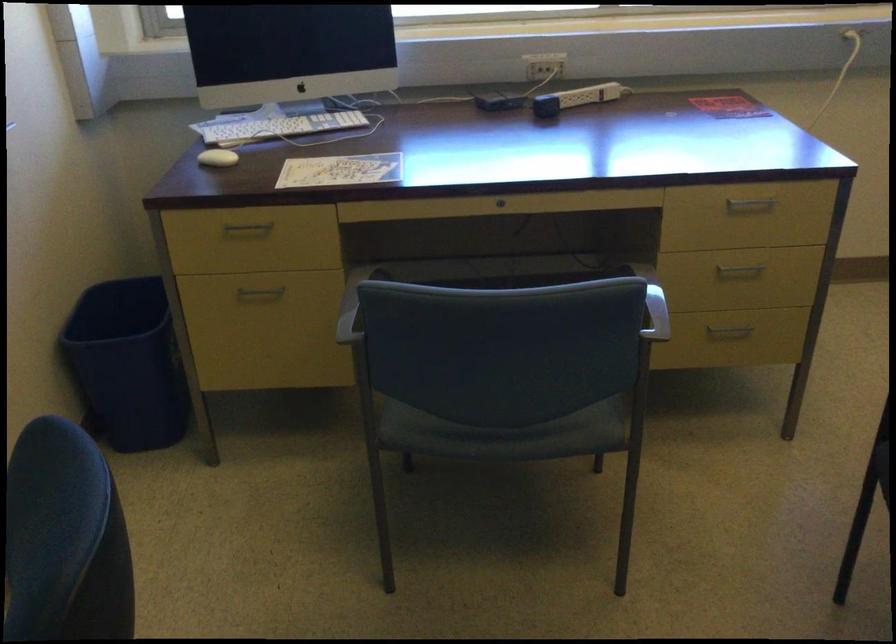
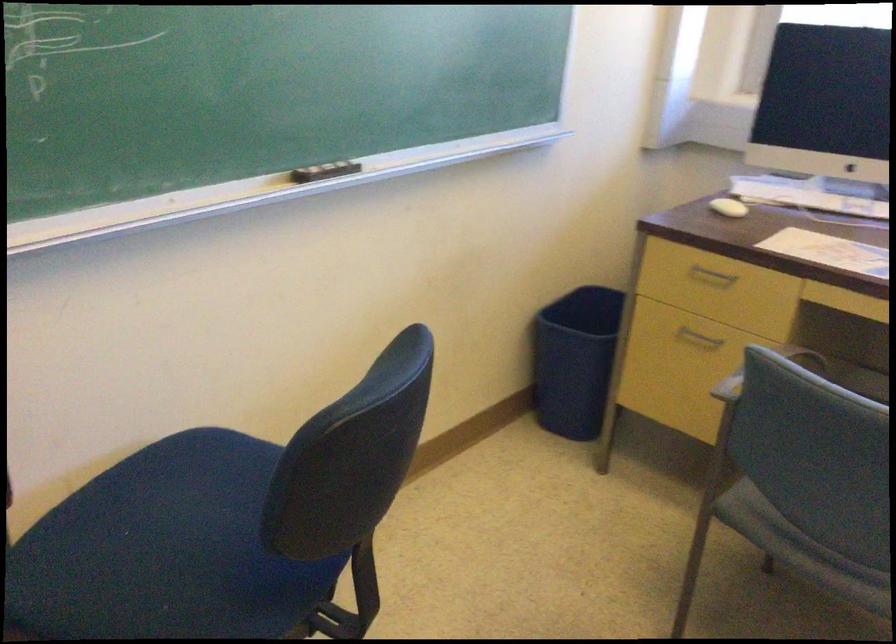
Locate, in the second image, the point that corresponds to pixel 382 304 in the first image.

(764, 371)